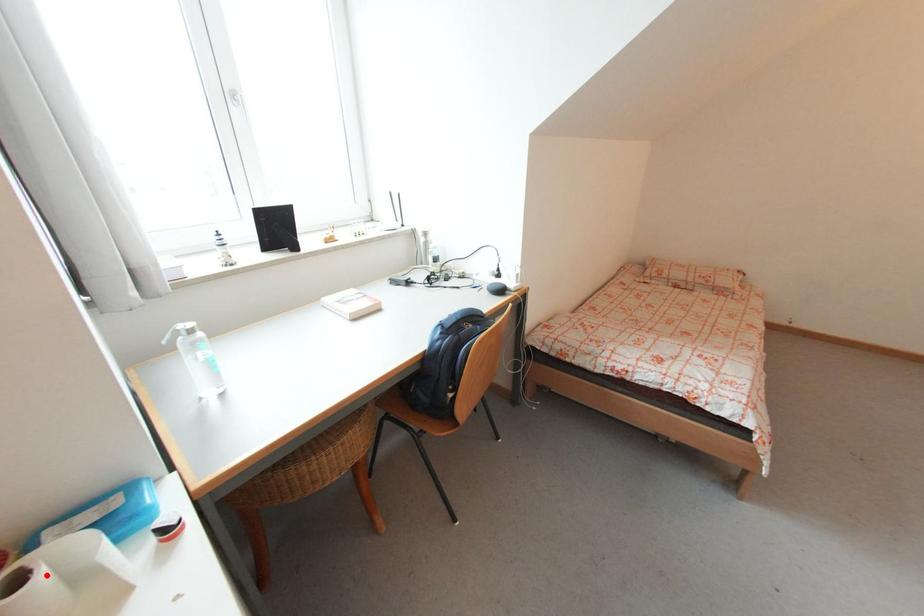
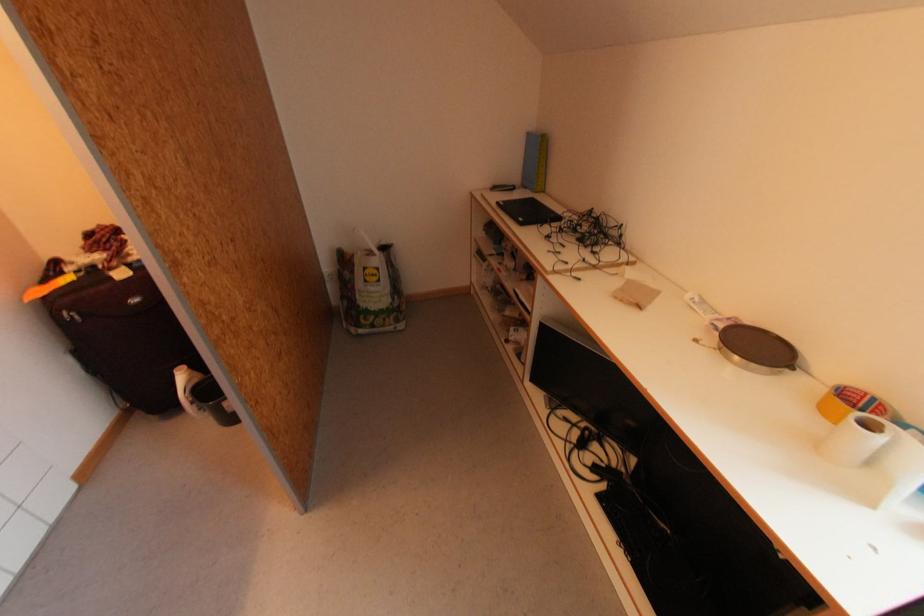
Find the pixel in the second image that matches the highlighted location in the first image.

(886, 439)